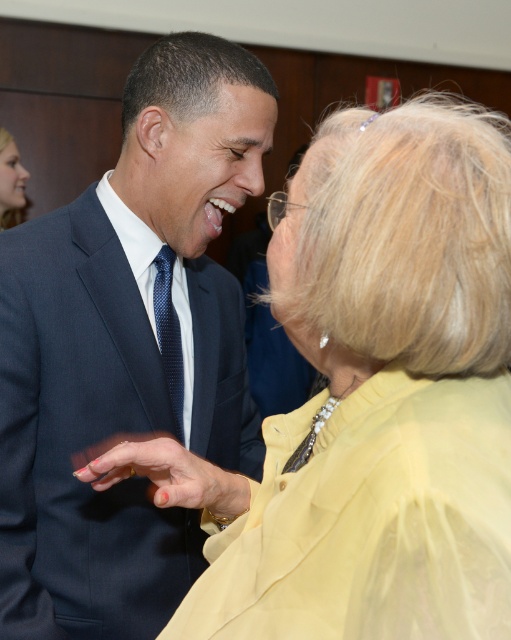
You are a fashion designer observing two outfits in the image. The yellow satin blouse at center and the matte black suit at center. Which one is shorter in height?

The yellow satin blouse at center has a lesser height compared to matte black suit at center, so the yellow satin blouse at center is shorter.